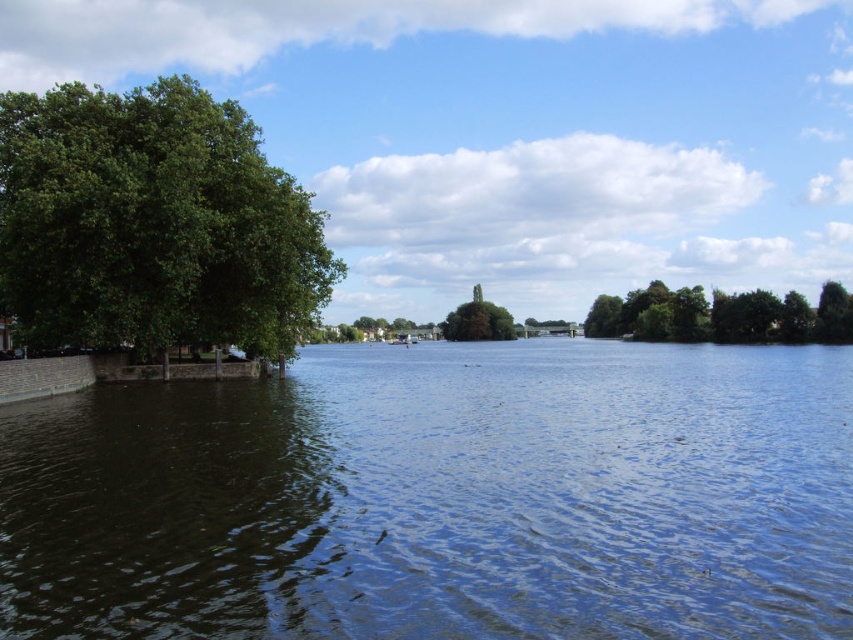
You are an artist setting up your easel to paint the riverside scene. You want to capture both the green leafy tree at left and the green leafy tree at center in your painting. Based on their sizes in the image, which tree should you focus on to ensure it appears larger in your artwork?

The green leafy tree at left might be wider than the green leafy tree at center, so focusing on the green leafy tree at left would likely make it appear larger in your artwork.

You are standing at the center of the image. Which direction should you look to see the green leafy tree at left?

The green leafy tree at left is located at point 0.350 on the x axis and 0.179 on the y axis, so you should look to the left side to see it.

Looking at this image, you are an artist sketching the riverside scene. You want to draw the dark blue water at center and the green leafy tree at center accurately. Based on their positions, which object should you sketch first to maintain proper spatial relationships?

You should sketch the dark blue water at center first because it is positioned to the left of the green leafy tree at center, so drawing the water first allows you to establish its leftward placement relative to the tree.